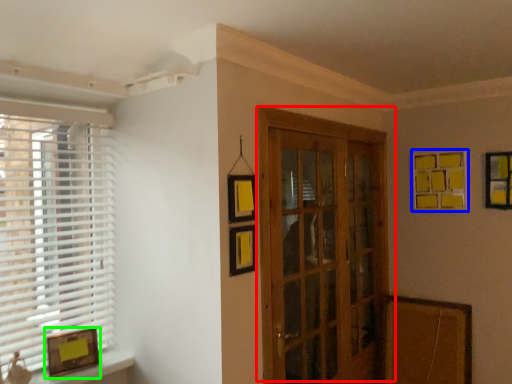
Question: Which is nearer to the door (highlighted by a red box)? picture frame (highlighted by a blue box) or picture frame (highlighted by a green box).

Choices:
 (A) picture frame
 (B) picture frame

Answer: (A)